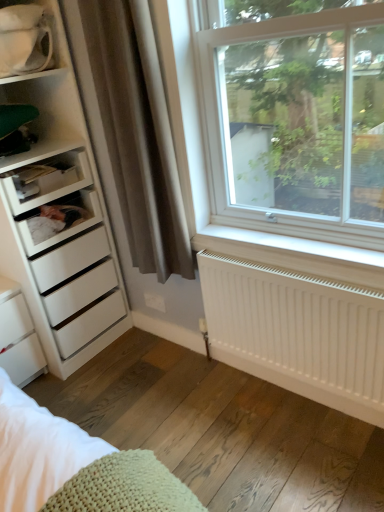
The image size is (384, 512). Describe the element at coordinates (25, 41) in the screenshot. I see `white glossy mug at upper left, which is the 1th shelf in top-to-bottom order` at that location.

Find the location of `white matte chest of drawers at lower left`. white matte chest of drawers at lower left is located at coordinates (18, 337).

This screenshot has width=384, height=512. I want to click on brown fabric curtain at left, so click(x=138, y=134).

The image size is (384, 512). What are the coordinates of `white glossy mug at upper left, which is the 1th shelf in top-to-bottom order` in the screenshot? It's located at (25, 41).

From a real-world perspective, is white matte radiator at lower right positioned above or below white plastic window at upper right?

white matte radiator at lower right is situated lower than white plastic window at upper right in the real world.

Considering the relative sizes of white matte radiator at lower right and white plastic window at upper right in the image provided, is white matte radiator at lower right wider than white plastic window at upper right?

No, white matte radiator at lower right is not wider than white plastic window at upper right.

This screenshot has width=384, height=512. In order to click on window in front of the white matte radiator at lower right in this screenshot , I will do pos(295,123).

Is white matte radiator at lower right next to white plastic window at upper right and touching it?

white matte radiator at lower right and white plastic window at upper right are clearly separated.

Can we say white plastic window at upper right lies outside white glossy mug at upper left, marked as the third shelf in a bottom-to-top arrangement?

Indeed, white plastic window at upper right is completely outside white glossy mug at upper left, marked as the third shelf in a bottom-to-top arrangement.

Is white plastic window at upper right looking in the opposite direction of white glossy mug at upper left, marked as the third shelf in a bottom-to-top arrangement?

white plastic window at upper right is not turned away from white glossy mug at upper left, marked as the third shelf in a bottom-to-top arrangement.

How many degrees apart are the facing directions of white plastic window at upper right and white glossy mug at upper left, which is the 1th shelf in top-to-bottom order?

They differ by 89.1 degrees in their facing directions.

Is white plastic window at upper right not near white matte drawer at left, marked as the third shelf in a top-to-bottom arrangement?

Absolutely, white plastic window at upper right is distant from white matte drawer at left, marked as the third shelf in a top-to-bottom arrangement.

Who is bigger, white plastic window at upper right or white matte drawer at left, marked as the 1th shelf in a bottom-to-top arrangement?

With larger size is white plastic window at upper right.

From the image's perspective, which is above, white plastic window at upper right or white matte drawer at left, marked as the 1th shelf in a bottom-to-top arrangement?

white plastic window at upper right.

Consider the image. Which of these two, white plastic window at upper right or white matte drawer at left, marked as the 1th shelf in a bottom-to-top arrangement, is thinner?

white plastic window at upper right.

Considering the relative sizes of white plastic shelf at left, the 2th shelf ordered from the bottom, and brown fabric curtain at left in the image provided, is white plastic shelf at left, the 2th shelf ordered from the bottom, smaller than brown fabric curtain at left?

Correct, white plastic shelf at left, the 2th shelf ordered from the bottom, occupies less space than brown fabric curtain at left.

From a real-world perspective, is white plastic shelf at left, the 2th shelf ordered from the bottom, physically located above or below brown fabric curtain at left?

From a real-world perspective, white plastic shelf at left, the 2th shelf ordered from the bottom, is physically below brown fabric curtain at left.

Is white plastic shelf at left, the 2th shelf from the top, oriented away from brown fabric curtain at left?

No, white plastic shelf at left, the 2th shelf from the top, is not facing the opposite direction of brown fabric curtain at left.

Can you confirm if brown fabric curtain at left is taller than white matte radiator at lower right?

Yes.

This screenshot has height=512, width=384. What are the coordinates of `curtain above the white matte radiator at lower right (from the image's perspective)` in the screenshot? It's located at (138, 134).

Between point (101, 28) and point (287, 382), which one is positioned in front?

The point (101, 28) is in front.

How far apart are brown fabric curtain at left and white matte radiator at lower right?

brown fabric curtain at left and white matte radiator at lower right are 21.59 inches apart.

Is white matte radiator at lower right positioned with its back to white plastic shelf at left, the 2th shelf from the top?

white matte radiator at lower right is not turned away from white plastic shelf at left, the 2th shelf from the top.

Based on the photo, between white matte radiator at lower right and white plastic shelf at left, the 2th shelf from the top, which one appears on the right side from the viewer's perspective?

From the viewer's perspective, white matte radiator at lower right appears more on the right side.

Is white matte radiator at lower right touching white plastic shelf at left, the 2th shelf from the top?

There is a gap between white matte radiator at lower right and white plastic shelf at left, the 2th shelf from the top.

How far apart are white matte radiator at lower right and white plastic shelf at left, the 2th shelf from the top?

white matte radiator at lower right is 1.05 meters from white plastic shelf at left, the 2th shelf from the top.

Which object is thinner, white plastic window at upper right or white matte chest of drawers at lower left?

white plastic window at upper right is thinner.

Which of these two, white plastic window at upper right or white matte chest of drawers at lower left, is bigger?

white plastic window at upper right.

Does white plastic window at upper right have a greater height compared to white matte chest of drawers at lower left?

Indeed, white plastic window at upper right has a greater height compared to white matte chest of drawers at lower left.

Which object is positioned more to the right, white plastic window at upper right or white matte chest of drawers at lower left?

From the viewer's perspective, white plastic window at upper right appears more on the right side.

Find the location of `radiator behind the white plastic window at upper right`. radiator behind the white plastic window at upper right is located at coordinates (298, 331).

You are a GUI agent. You are given a task and a screenshot of the screen. Output one action in this format:
    pyautogui.click(x=<x>, y=<y>)
    Task: Click on the window on the right of white glossy mug at upper left, which is the 1th shelf in top-to-bottom order
    This screenshot has width=384, height=512.
    Given the screenshot: What is the action you would take?
    click(x=295, y=123)

Based on their spatial positions, is white matte radiator at lower right or white matte drawer at left, marked as the 1th shelf in a bottom-to-top arrangement, further from white plastic shelf at left, the 2th shelf ordered from the bottom?

white matte radiator at lower right is further to white plastic shelf at left, the 2th shelf ordered from the bottom.

Looking at the image, which one is located further to white plastic shelf at left, the 2th shelf from the top, white matte drawer at left, marked as the 1th shelf in a bottom-to-top arrangement, or white matte radiator at lower right?

Based on the image, white matte radiator at lower right appears to be further to white plastic shelf at left, the 2th shelf from the top.

Based on their spatial positions, is white matte drawer at left, marked as the 1th shelf in a bottom-to-top arrangement, or white matte radiator at lower right closer to white plastic window at upper right?

Based on the image, white matte radiator at lower right appears to be nearer to white plastic window at upper right.

Looking at the image, which one is located further to white matte chest of drawers at lower left, white matte radiator at lower right or white plastic window at upper right?

white plastic window at upper right lies further to white matte chest of drawers at lower left than the other object.

Estimate the real-world distances between objects in this image. Which object is further from white plastic window at upper right, white plastic shelf at left, the 2th shelf from the top, or brown fabric curtain at left?

white plastic shelf at left, the 2th shelf from the top.

Considering their positions, is brown fabric curtain at left positioned further to white glossy mug at upper left, marked as the third shelf in a bottom-to-top arrangement, than white matte drawer at left, marked as the 1th shelf in a bottom-to-top arrangement?

The object further to white glossy mug at upper left, marked as the third shelf in a bottom-to-top arrangement, is white matte drawer at left, marked as the 1th shelf in a bottom-to-top arrangement.

Based on their spatial positions, is white matte radiator at lower right or brown fabric curtain at left closer to white matte drawer at left, marked as the third shelf in a top-to-bottom arrangement?

The object closer to white matte drawer at left, marked as the third shelf in a top-to-bottom arrangement, is brown fabric curtain at left.

Based on their spatial positions, is white matte drawer at left, marked as the 1th shelf in a bottom-to-top arrangement, or white plastic window at upper right closer to brown fabric curtain at left?

white matte drawer at left, marked as the 1th shelf in a bottom-to-top arrangement, is positioned closer to the anchor brown fabric curtain at left.

At what (x,y) coordinates should I click in order to perform the action: click on shelf between white matte drawer at left, marked as the 1th shelf in a bottom-to-top arrangement, and white matte radiator at lower right. Please return your answer as a coordinate pair (x, y). This screenshot has width=384, height=512. Looking at the image, I should click on pyautogui.click(x=25, y=41).

Find the location of a particular element. This screenshot has height=512, width=384. window between white plastic shelf at left, the 2th shelf from the top, and white matte radiator at lower right, in the horizontal direction is located at coordinates (295, 123).

Where is `shelf situated between white matte drawer at left, marked as the third shelf in a top-to-bottom arrangement, and white plastic window at upper right from left to right`? shelf situated between white matte drawer at left, marked as the third shelf in a top-to-bottom arrangement, and white plastic window at upper right from left to right is located at coordinates (25, 41).

The height and width of the screenshot is (512, 384). What are the coordinates of `window between white matte chest of drawers at lower left and white matte radiator at lower right` in the screenshot? It's located at pyautogui.click(x=295, y=123).